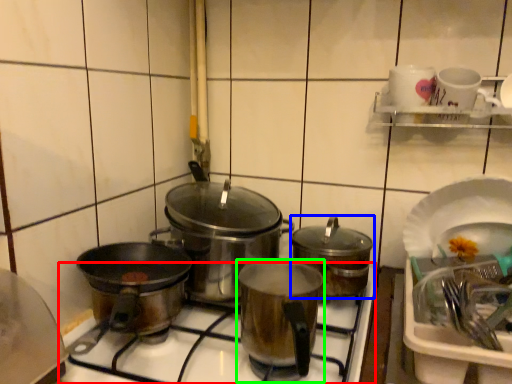
Question: Based on their relative distances, which object is nearer to gas stove (highlighted by a red box)? Choose from kitchen appliance (highlighted by a blue box) and kitchen appliance (highlighted by a green box).

Choices:
 (A) kitchen appliance
 (B) kitchen appliance

Answer: (B)